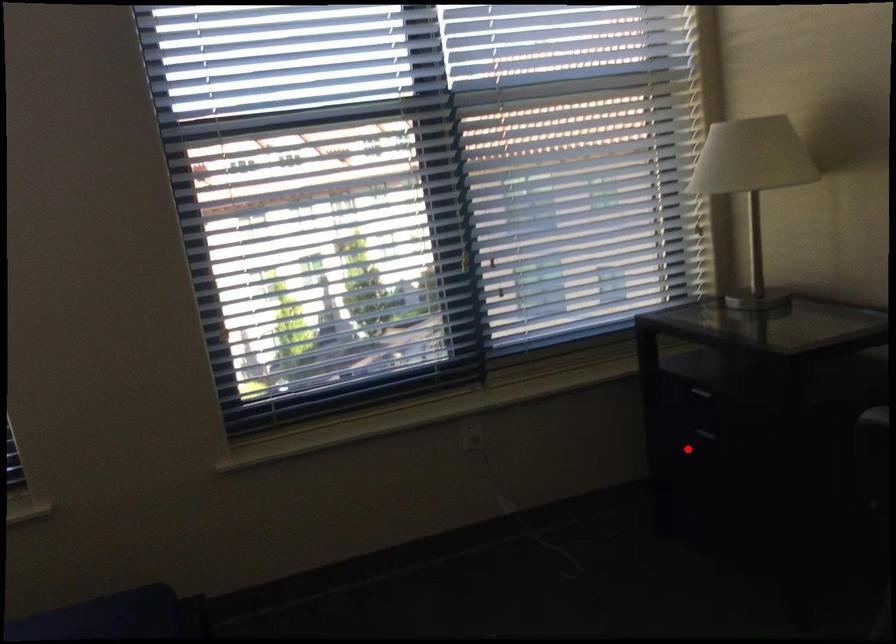
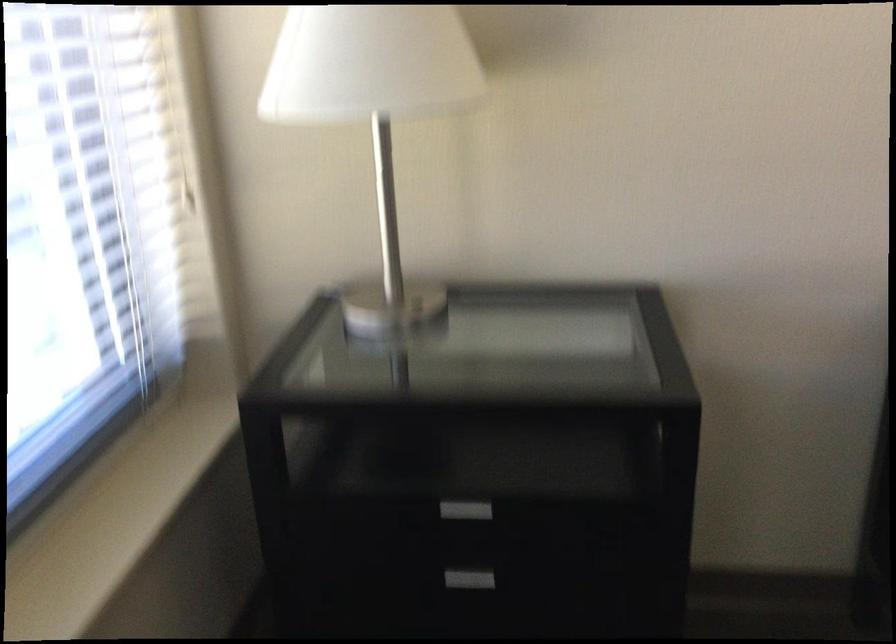
Find the pixel in the second image that matches the highlighted location in the first image.

(476, 569)